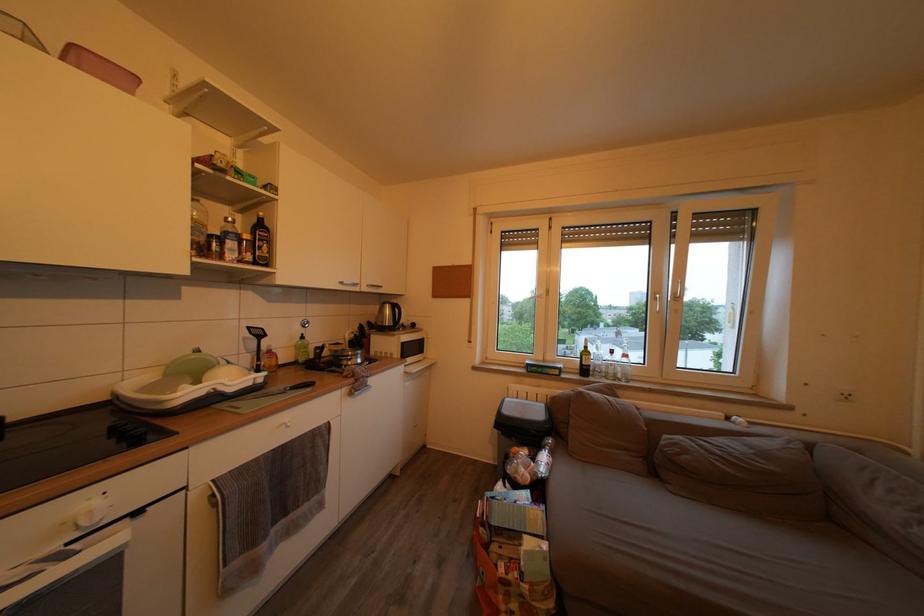
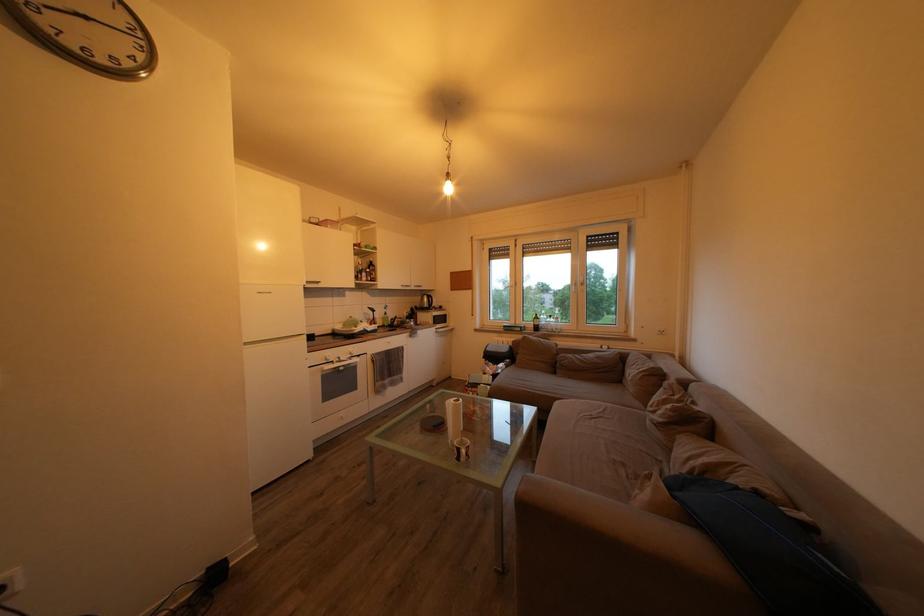
The point at (355, 339) is marked in the first image. Where is the corresponding point in the second image?

(412, 318)